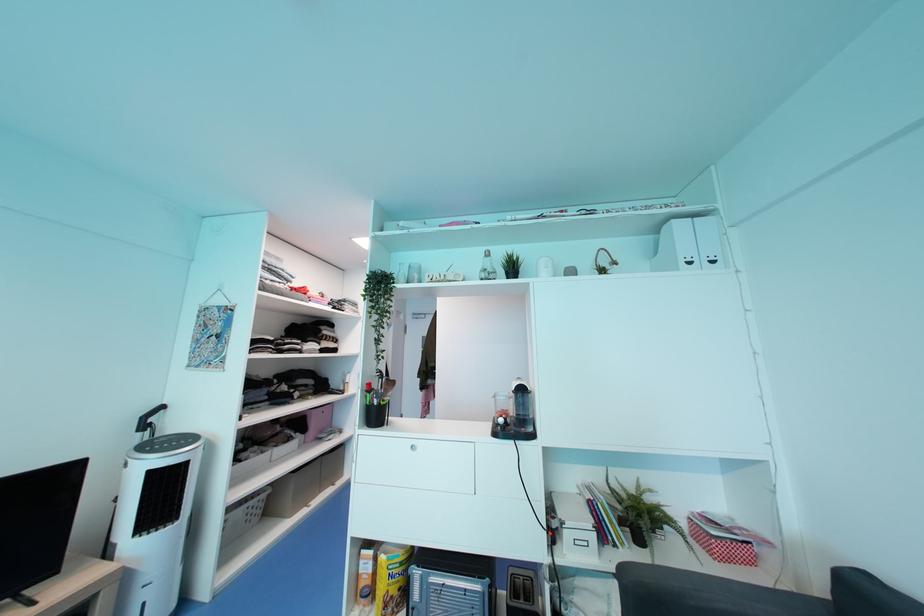
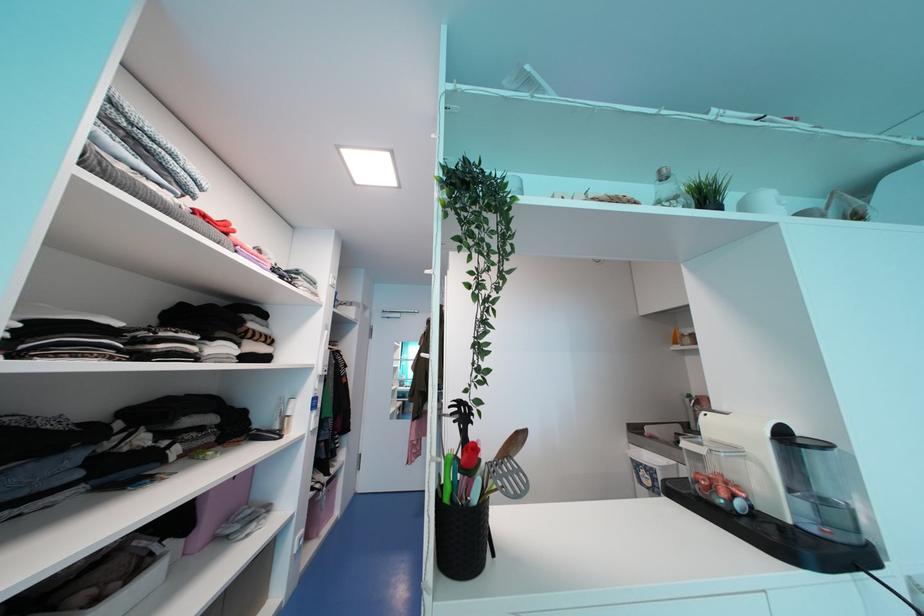
Which direction would the cameraman need to move to produce the second image?

The cameraman moved toward left, forward.